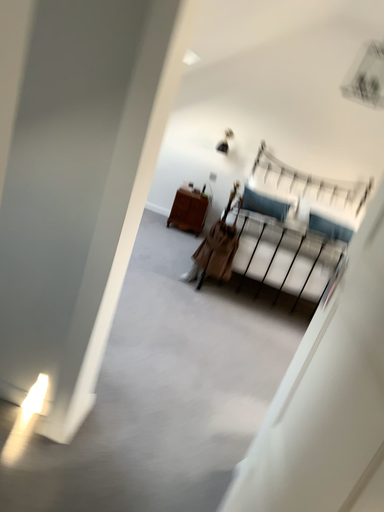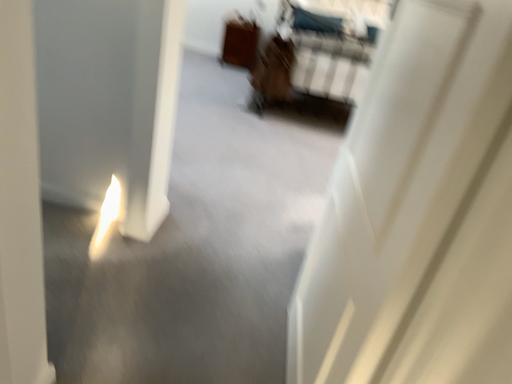
Question: How did the camera likely rotate when shooting the video?

Choices:
 (A) rotated upward
 (B) rotated downward

Answer: (B)